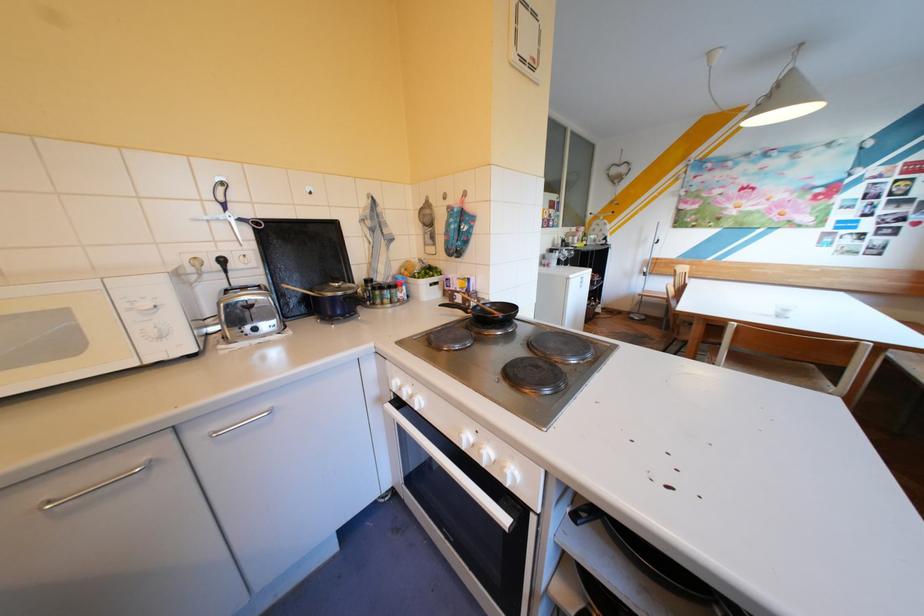
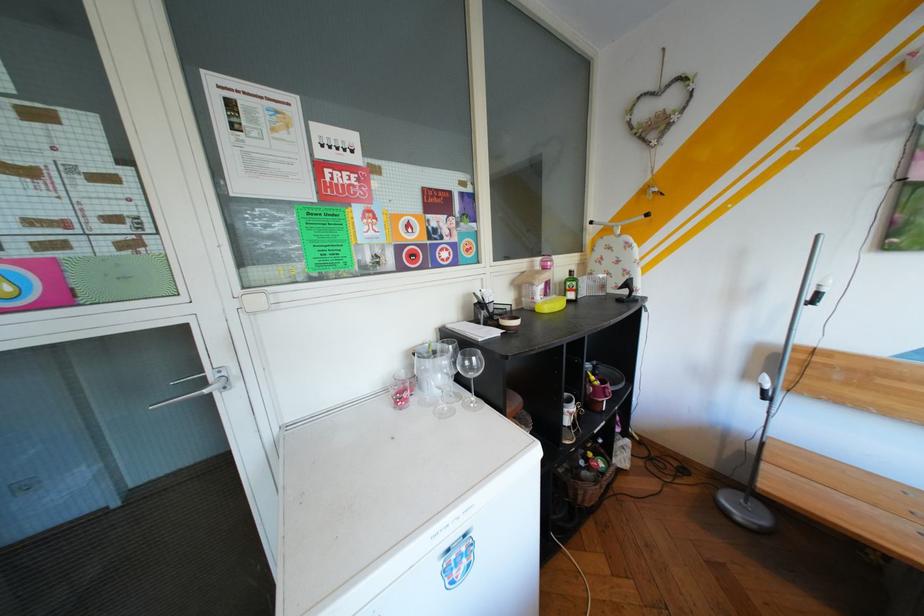
In the second image, find the point that corresponds to point 588,236 in the first image.

(545, 284)